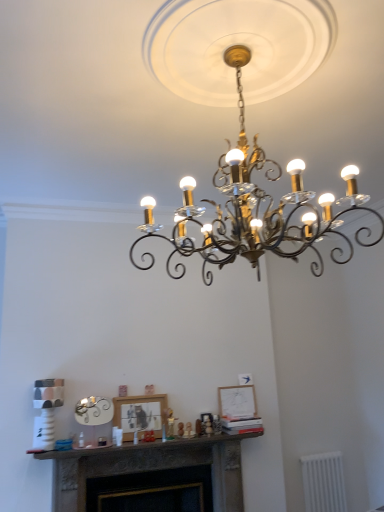
Where is `free space above white plastic radiator at lower right (from a real-world perspective)`? free space above white plastic radiator at lower right (from a real-world perspective) is located at coordinates (320, 452).